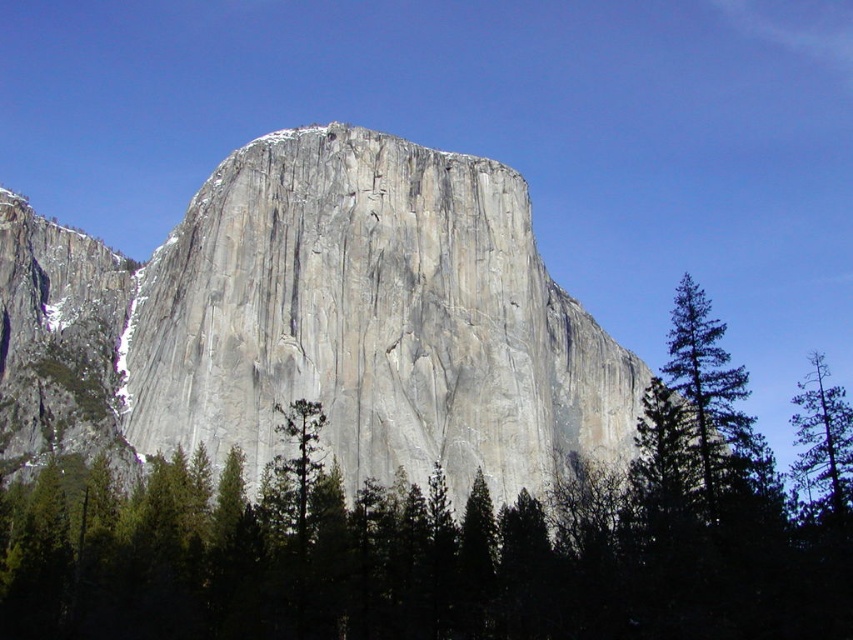
Question: Which of the following is the closest to the observer?

Choices:
 (A) (721, 369)
 (B) (599, 376)

Answer: (A)

Question: Which of the following is the closest to the observer?

Choices:
 (A) gray rock formation at center
 (B) green coniferous tree at right

Answer: (B)

Question: Does gray rock formation at center appear over green coniferous tree at right?

Choices:
 (A) yes
 (B) no

Answer: (A)

Question: Does gray rock formation at center appear over green textured tree at right?

Choices:
 (A) yes
 (B) no

Answer: (A)

Question: Does green coniferous tree at right have a greater width compared to green textured tree at right?

Choices:
 (A) no
 (B) yes

Answer: (A)

Question: Among these objects, which one is farthest from the camera?

Choices:
 (A) green textured tree at right
 (B) green coniferous tree at right

Answer: (B)